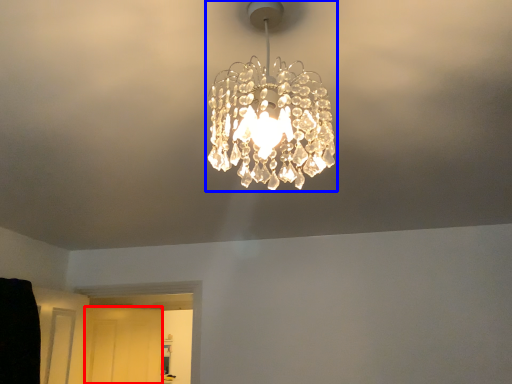
Question: Which point is closer to the camera, glass door (highlighted by a red box) or lamp (highlighted by a blue box)?

Choices:
 (A) glass door
 (B) lamp

Answer: (B)